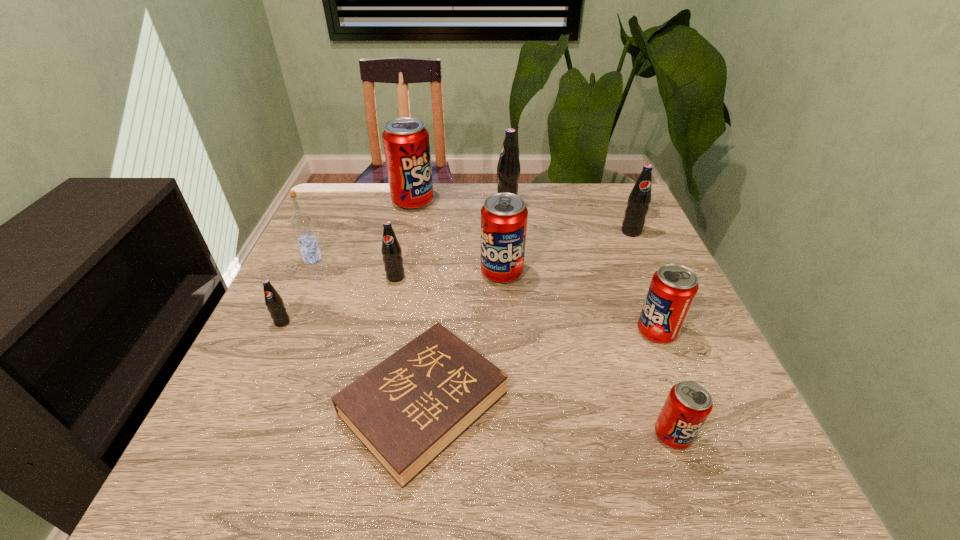
At what (x,y) coordinates should I click in order to perform the action: click on soda can that is positioned at the near edge. Please return your answer as a coordinate pair (x, y). The height and width of the screenshot is (540, 960). Looking at the image, I should click on [x=689, y=403].

Where is `hardback book that is at the near edge`? The height and width of the screenshot is (540, 960). hardback book that is at the near edge is located at coordinates (408, 409).

Identify the location of vodka present at the left edge. The height and width of the screenshot is (540, 960). (301, 222).

Find the location of a particular element. Image resolution: width=960 pixels, height=540 pixels. pop that is at the left edge is located at coordinates (273, 301).

Identify the location of object situated at the far right corner. The image size is (960, 540). (639, 199).

Identify the location of object at the near right corner. The height and width of the screenshot is (540, 960). (689, 403).

Identify the location of vacant space at the far edge. The image size is (960, 540). (542, 185).

Where is `vacant space at the near edge`? This screenshot has height=540, width=960. vacant space at the near edge is located at coordinates (635, 465).

Identify the location of free region at the left edge of the desktop. The image size is (960, 540). point(289,312).

Where is `vacant space at the right edge of the desktop`? This screenshot has height=540, width=960. vacant space at the right edge of the desktop is located at coordinates (687, 321).